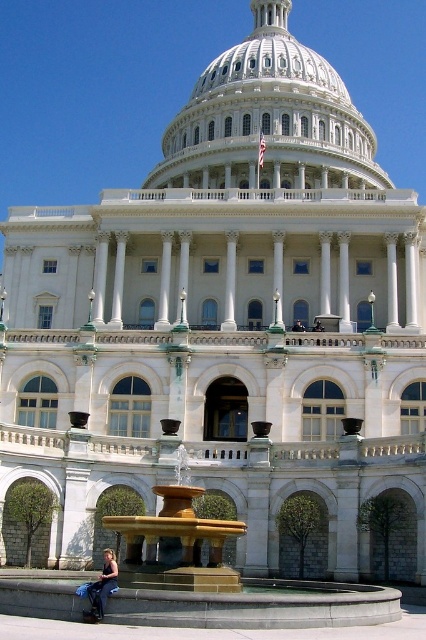
Who is shorter, denim jacket at lower left or dark blue uniform at center?

dark blue uniform at center

Is denim jacket at lower left bigger than dark blue uniform at center?

Correct, denim jacket at lower left is larger in size than dark blue uniform at center.

This screenshot has width=426, height=640. What do you see at coordinates (101, 588) in the screenshot?
I see `denim jacket at lower left` at bounding box center [101, 588].

You are a GUI agent. You are given a task and a screenshot of the screen. Output one action in this format:
    pyautogui.click(x=<x>, y=<y>)
    Task: Click on the denim jacket at lower left
    
    Given the screenshot: What is the action you would take?
    pyautogui.click(x=101, y=588)

Does point (281, 301) lie in front of point (301, 340)?

No, (281, 301) is behind (301, 340).

Which is in front, point (275, 230) or point (296, 330)?

Point (296, 330) is in front.

Where is `white marble column at center`? The height and width of the screenshot is (640, 426). white marble column at center is located at coordinates [x=278, y=276].

Is the position of white marble dome at upper center less distant than that of dark blue uniform at center?

No.

Consider the image. Which is below, white marble dome at upper center or dark blue uniform at center?

dark blue uniform at center is lower down.

Which is in front, point (232, 97) or point (293, 321)?

Point (293, 321) is in front.

Find the location of `white marble dome at upper center`. white marble dome at upper center is located at coordinates (267, 112).